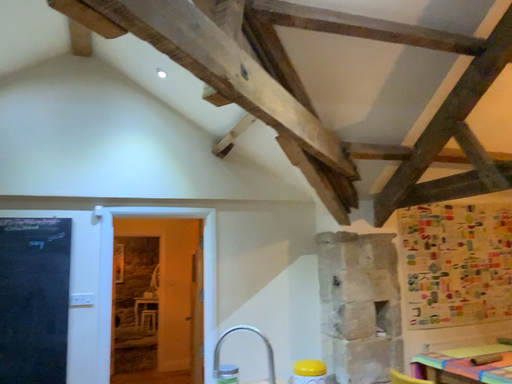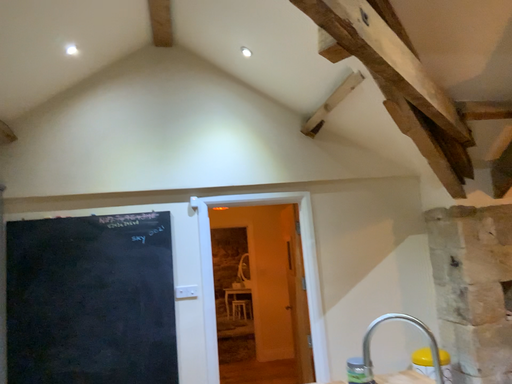
Question: Which way did the camera rotate in the video?

Choices:
 (A) rotated left
 (B) rotated right

Answer: (A)